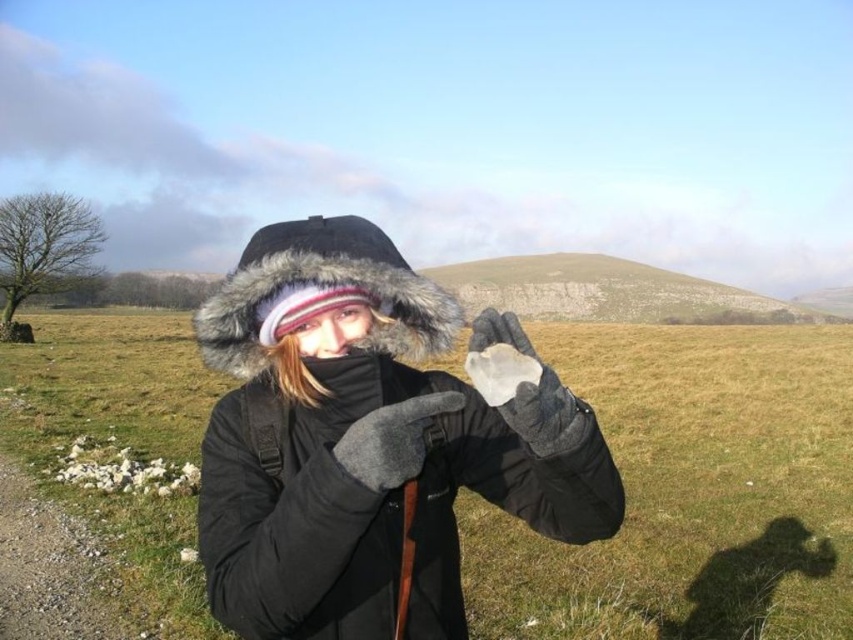
Question: Can you confirm if black fuzzy jacket at center is positioned to the right of gray fleece glove at center?

Choices:
 (A) no
 (B) yes

Answer: (A)

Question: Which of the following is the closest to the observer?

Choices:
 (A) translucent glass at center
 (B) transparent glass rock at center

Answer: (A)

Question: Which is farther from the translucent glass at center?

Choices:
 (A) gray fleece glove at center
 (B) fuzzy fur hat at center
 (C) transparent glass rock at center

Answer: (C)

Question: Is gray fleece glove at center closer to camera compared to translucent glass at center?

Choices:
 (A) yes
 (B) no

Answer: (A)

Question: Which object appears closest to the camera in this image?

Choices:
 (A) black fuzzy jacket at center
 (B) transparent glass rock at center
 (C) fuzzy fur hat at center

Answer: (A)

Question: Can you confirm if black fuzzy jacket at center is smaller than translucent glass at center?

Choices:
 (A) no
 (B) yes

Answer: (A)